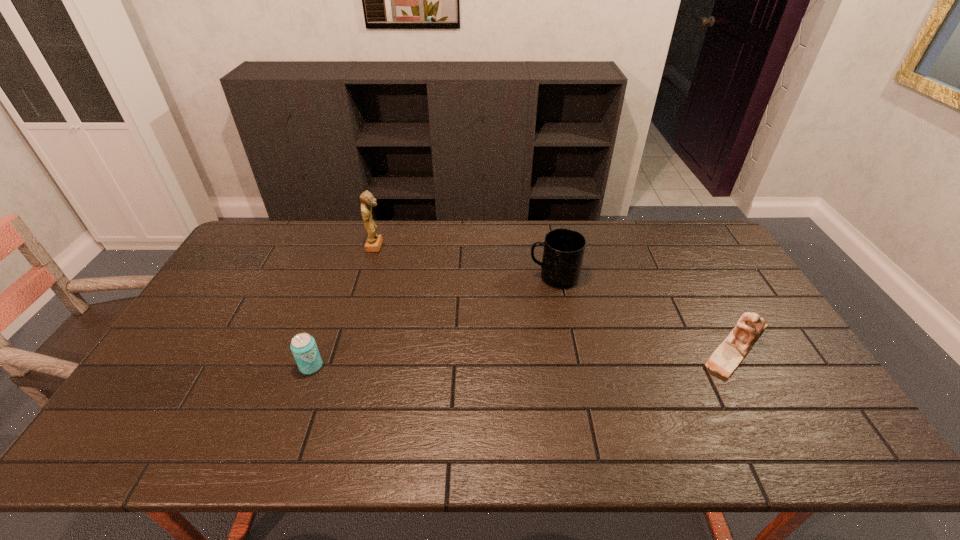
Locate an element on the screen. The image size is (960, 540). vacant space located 0.230m on the side of the third object from left to right with the handle is located at coordinates [458, 277].

Locate an element on the screen. The height and width of the screenshot is (540, 960). blank space located 0.360m on the side of the third object from left to right with the handle is located at coordinates (419, 277).

In order to click on vacant space situated on the front-facing side of the right figurine in this screenshot , I will do `click(613, 349)`.

Where is `vacant region located 0.350m on the front-facing side of the right figurine`? The image size is (960, 540). vacant region located 0.350m on the front-facing side of the right figurine is located at coordinates (570, 349).

The height and width of the screenshot is (540, 960). I want to click on vacant space located on the front-facing side of the right figurine, so click(x=552, y=349).

Identify the location of free space located 0.270m on the left of the beer can. This screenshot has height=540, width=960. [198, 367].

The height and width of the screenshot is (540, 960). In order to click on object at the far edge in this screenshot , I will do `click(373, 243)`.

I want to click on object located at the right edge, so click(x=727, y=357).

The height and width of the screenshot is (540, 960). In order to click on vacant space at the far edge in this screenshot , I will do `click(477, 250)`.

In the image, there is a desktop. Where is `free region at the near edge`? This screenshot has height=540, width=960. free region at the near edge is located at coordinates (556, 435).